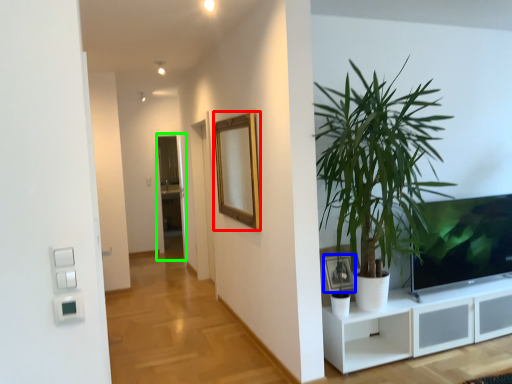
Question: Based on their relative distances, which object is nearer to mirror (highlighted by a red box)? Choose from picture frame (highlighted by a blue box) and glass door (highlighted by a green box).

Choices:
 (A) picture frame
 (B) glass door

Answer: (A)